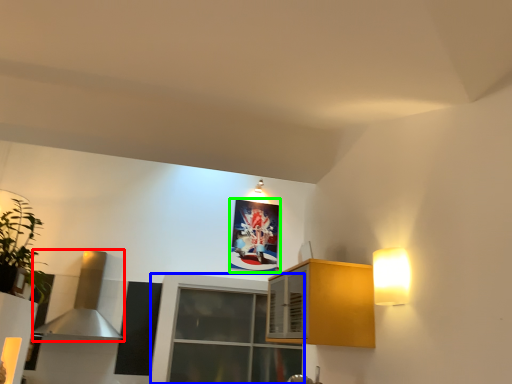
Question: Which is farther away from exhaust hood (highlighted by a red box)? window (highlighted by a blue box) or picture frame (highlighted by a green box)?

Choices:
 (A) window
 (B) picture frame

Answer: (B)